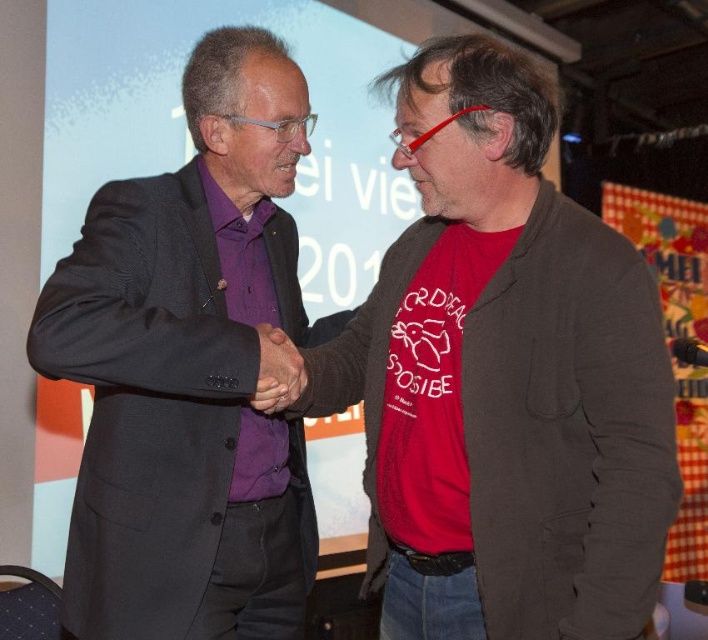
From the picture: You are standing in front of the two people shaking hands. You want to place a small gift exactly halfway between the two points labeled point (603, 605) and point (181, 492). Will the gift be closer to the person on the left or the right?

The gift placed halfway between point (603, 605) and point (181, 492) will be closer to the person on the right because point (603, 605) is closer to the viewer than point (181, 492), so the midpoint leans towards the farther point.

You are a photographer standing in front of the scene. You want to take a closeup shot of the purple matte suit at center without moving the camera. Can you zoom in enough to capture the suit clearly?

The purple matte suit at center is 1.14 meters away from the viewer. If your camera has sufficient zoom capabilities, you can zoom in to capture the suit clearly from that distance without moving the camera.

Looking at this image, you are an event planner arranging a photo shoot and need to position a spotlight exactly at the center of the purple matte suit at center. According to the coordinates provided, where should you aim the spotlight?

The purple matte suit at center is located at point coordinates (190, 371), so you should aim the spotlight at those coordinates to hit the center of the purple matte suit at center.